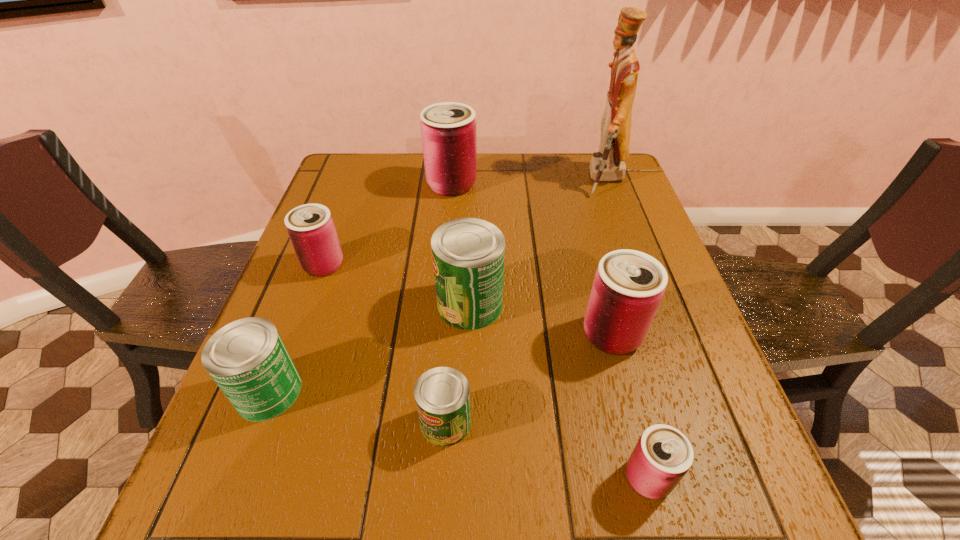
The width and height of the screenshot is (960, 540). In order to click on free space that is in between the tallest can and the nearest can in this screenshot , I will do `click(550, 331)`.

Image resolution: width=960 pixels, height=540 pixels. Find the location of `free space between the second biggest green can and the third smallest pink can`. free space between the second biggest green can and the third smallest pink can is located at coordinates (441, 363).

Identify which object is the fifth closest to the tallest object. Please provide its 2D coordinates. Your answer should be formatted as a tuple, i.e. [(x, y)], where the tuple contains the x and y coordinates of a point satisfying the conditions above.

[(442, 395)]

Locate which object is the closest to the biggest pink can. Please provide its 2D coordinates. Your answer should be formatted as a tuple, i.e. [(x, y)], where the tuple contains the x and y coordinates of a point satisfying the conditions above.

[(311, 229)]

Identify which can is located as the second nearest to the red nutcracker. Please provide its 2D coordinates. Your answer should be formatted as a tuple, i.e. [(x, y)], where the tuple contains the x and y coordinates of a point satisfying the conditions above.

[(468, 254)]

Locate which can is the second closest to the tallest object. Please provide its 2D coordinates. Your answer should be formatted as a tuple, i.e. [(x, y)], where the tuple contains the x and y coordinates of a point satisfying the conditions above.

[(468, 254)]

Select which pink can is the third closest to the farthest green can. Please provide its 2D coordinates. Your answer should be formatted as a tuple, i.e. [(x, y)], where the tuple contains the x and y coordinates of a point satisfying the conditions above.

[(662, 456)]

Identify which pink can is the nearest to the third smallest pink can. Please provide its 2D coordinates. Your answer should be formatted as a tuple, i.e. [(x, y)], where the tuple contains the x and y coordinates of a point satisfying the conditions above.

[(662, 456)]

Identify which green can is the second nearest to the second biggest pink can. Please provide its 2D coordinates. Your answer should be formatted as a tuple, i.e. [(x, y)], where the tuple contains the x and y coordinates of a point satisfying the conditions above.

[(442, 395)]

Locate an element on the screen. green can that can be found as the second closest to the nearest object is located at coordinates (468, 254).